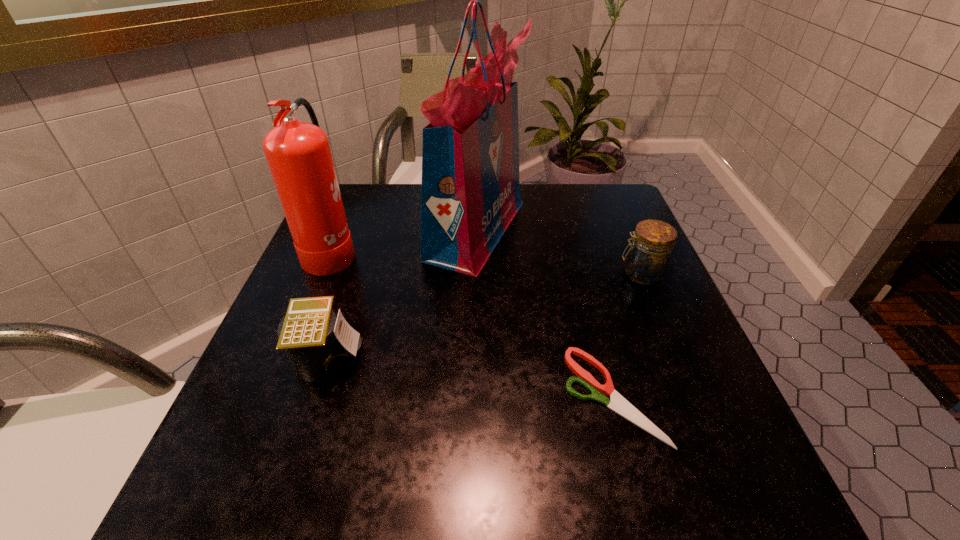
Identify the location of grocery bag. The image size is (960, 540). (470, 193).

Identify the location of the tallest object. This screenshot has width=960, height=540. (470, 193).

You are a GUI agent. You are given a task and a screenshot of the screen. Output one action in this format:
    pyautogui.click(x=<x>, y=<y>)
    Task: Click on the second tallest object
    The height and width of the screenshot is (540, 960).
    Given the screenshot: What is the action you would take?
    pyautogui.click(x=299, y=157)

You are a GUI agent. You are given a task and a screenshot of the screen. Output one action in this format:
    pyautogui.click(x=<x>, y=<y>)
    Task: Click on the rightmost object
    The width and height of the screenshot is (960, 540).
    Given the screenshot: What is the action you would take?
    pyautogui.click(x=647, y=260)

The height and width of the screenshot is (540, 960). Identify the location of the third tallest object. (647, 260).

What are the coordinates of `calculator` in the screenshot? It's located at (319, 345).

This screenshot has width=960, height=540. I want to click on the fourth object from left to right, so click(617, 403).

This screenshot has height=540, width=960. What are the coordinates of `the shortest object` in the screenshot? It's located at (617, 403).

Locate an element on the screen. Image resolution: width=960 pixels, height=540 pixels. free spot located 0.100m on the front-facing side of the grocery bag is located at coordinates (567, 230).

Locate an element on the screen. vacant area located towards the nozzle of the second tallest object is located at coordinates (435, 250).